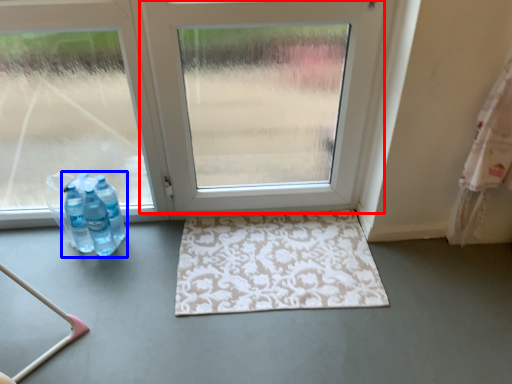
Question: Which object is closer to the camera taking this photo, door (highlighted by a red box) or bottle (highlighted by a blue box)?

Choices:
 (A) door
 (B) bottle

Answer: (A)